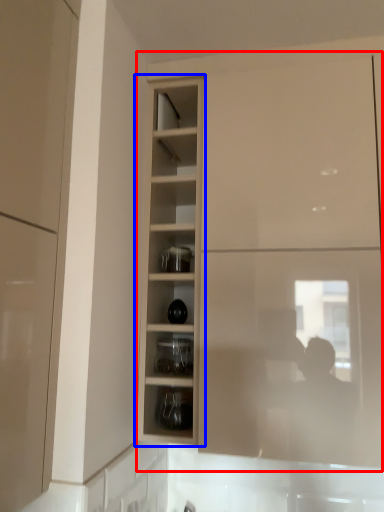
Question: Among these objects, which one is farthest to the camera, cabinetry (highlighted by a red box) or cupboard (highlighted by a blue box)?

Choices:
 (A) cabinetry
 (B) cupboard

Answer: (B)